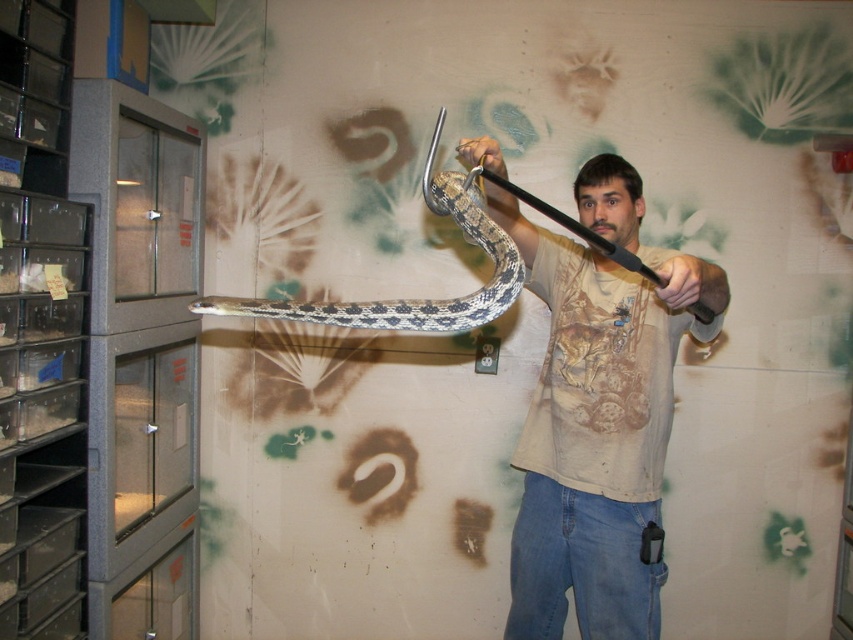
You are a veterinarian examining two snakes in the image. The patterned scales snake at center and the matte black snake at upper center. Which snake is located below the other?

The patterned scales snake at center is positioned under the matte black snake at upper center, so the patterned scales snake at center is below the matte black snake at upper center.